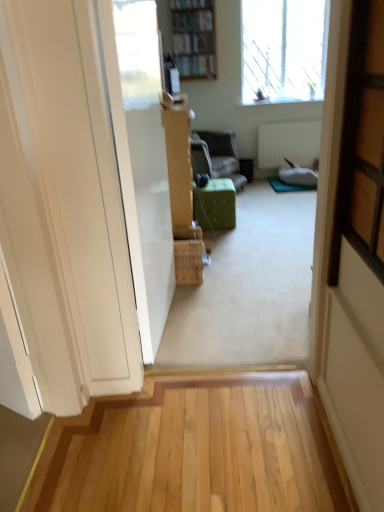
Question: Are transparent glass window at upper right and green fabric ottoman at center, the 2th furniture from the top, located far from each other?

Choices:
 (A) no
 (B) yes

Answer: (B)

Question: Considering the relative sizes of transparent glass window at upper right and green fabric ottoman at center, the first furniture in the front-to-back sequence, in the image provided, is transparent glass window at upper right thinner than green fabric ottoman at center, the first furniture in the front-to-back sequence,?

Choices:
 (A) no
 (B) yes

Answer: (B)

Question: Is transparent glass window at upper right at the left side of green fabric ottoman at center, marked as the first furniture in a bottom-to-top arrangement?

Choices:
 (A) no
 (B) yes

Answer: (A)

Question: Is transparent glass window at upper right in contact with green fabric ottoman at center, the second furniture from the back?

Choices:
 (A) yes
 (B) no

Answer: (B)

Question: Considering the relative sizes of transparent glass window at upper right and green fabric ottoman at center, the second furniture from the back, in the image provided, is transparent glass window at upper right smaller than green fabric ottoman at center, the second furniture from the back,?

Choices:
 (A) yes
 (B) no

Answer: (B)

Question: Is green fabric ottoman at center, the first furniture in the front-to-back sequence, inside the boundaries of green fabric ottoman at center, which is the 1th furniture from top to bottom, or outside?

Choices:
 (A) outside
 (B) inside

Answer: (A)

Question: From a real-world perspective, is green fabric ottoman at center, the 2th furniture from the top, positioned above or below green fabric ottoman at center, acting as the second furniture starting from the bottom?

Choices:
 (A) above
 (B) below

Answer: (B)

Question: Is green fabric ottoman at center, the 2th furniture from the top, in front of or behind green fabric ottoman at center, acting as the second furniture starting from the bottom, in the image?

Choices:
 (A) front
 (B) behind

Answer: (A)

Question: In terms of size, does green fabric ottoman at center, marked as the first furniture in a bottom-to-top arrangement, appear bigger or smaller than green fabric ottoman at center, which is the second furniture from front to back?

Choices:
 (A) big
 (B) small

Answer: (B)

Question: Do you think wooden bookshelf at upper center is within green fabric ottoman at center, arranged as the 1th furniture when viewed from the back, or outside of it?

Choices:
 (A) outside
 (B) inside

Answer: (A)

Question: Considering the positions of point (196, 51) and point (203, 154), is point (196, 51) closer or farther from the camera than point (203, 154)?

Choices:
 (A) closer
 (B) farther

Answer: (B)

Question: From a real-world perspective, is wooden bookshelf at upper center physically located above or below green fabric ottoman at center, which is the second furniture from front to back?

Choices:
 (A) below
 (B) above

Answer: (B)

Question: In terms of width, does wooden bookshelf at upper center look wider or thinner when compared to green fabric ottoman at center, arranged as the 1th furniture when viewed from the back?

Choices:
 (A) thin
 (B) wide

Answer: (A)

Question: Does point 297,54 appear closer or farther from the camera than point 208,212?

Choices:
 (A) farther
 (B) closer

Answer: (A)

Question: Is transparent glass window at upper right wider or thinner than green fabric ottoman at center, the 2th furniture from the top?

Choices:
 (A) wide
 (B) thin

Answer: (B)